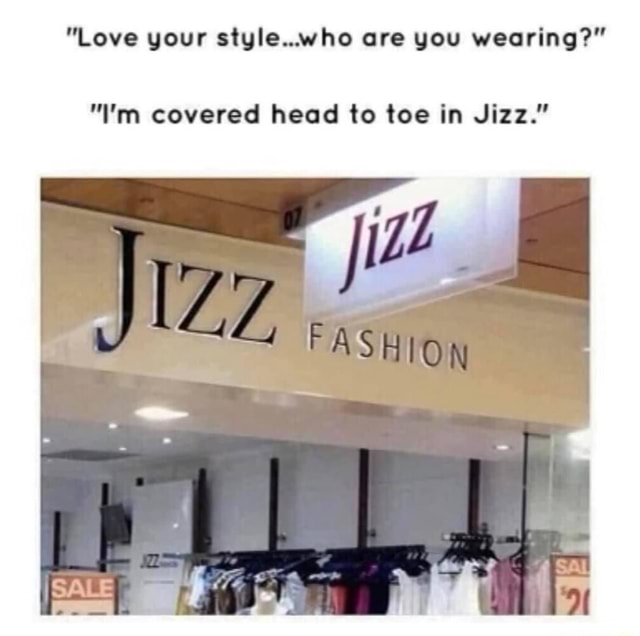
Locate an element on the screen. ceiling inside store is located at coordinates (77, 434).